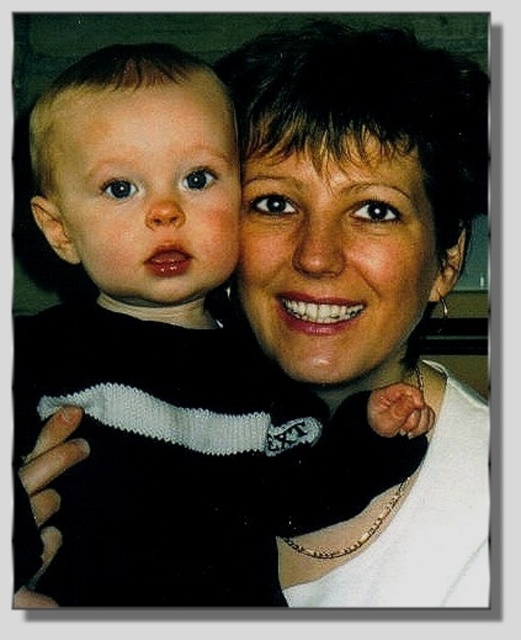
Can you confirm if black knitted sweater at left is positioned to the right of matte black sweater at center?

In fact, black knitted sweater at left is to the left of matte black sweater at center.

Between black knitted sweater at left and matte black sweater at center, which one is positioned higher?

matte black sweater at center is above.

Who is more forward, (227,604) or (340,236)?

Point (340,236) is in front.

You are a GUI agent. You are given a task and a screenshot of the screen. Output one action in this format:
    pyautogui.click(x=<x>, y=<y>)
    Task: Click on the black knitted sweater at left
    The width and height of the screenshot is (521, 640).
    Given the screenshot: What is the action you would take?
    pyautogui.click(x=169, y=362)

Who is higher up, smooth skin face at center or matte black baby at left?

Positioned higher is matte black baby at left.

Is smooth skin face at center closer to camera compared to matte black baby at left?

No, it is behind matte black baby at left.

Which is behind, point (303, 328) or point (47, 228)?

The point (47, 228) is behind.

The image size is (521, 640). I want to click on smooth skin face at center, so click(337, 259).

Is matte black sweater at center smaller than smooth skin face at center?

Actually, matte black sweater at center might be larger than smooth skin face at center.

From the picture: Can you confirm if matte black sweater at center is wider than smooth skin face at center?

Yes, matte black sweater at center is wider than smooth skin face at center.

Does point (485, 538) come behind point (339, 374)?

Yes, it is behind point (339, 374).

This screenshot has height=640, width=521. I want to click on matte black sweater at center, so pyautogui.click(x=353, y=195).